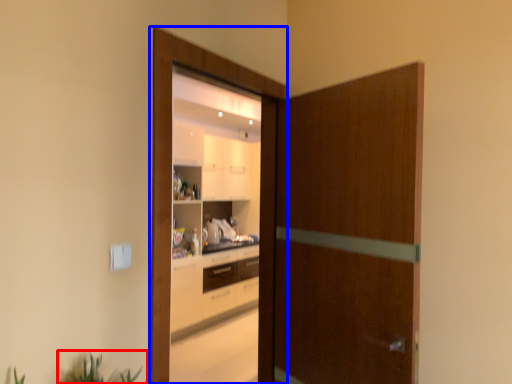
Question: Which object is further to the camera taking this photo, plant (highlighted by a red box) or screen door (highlighted by a blue box)?

Choices:
 (A) plant
 (B) screen door

Answer: (B)